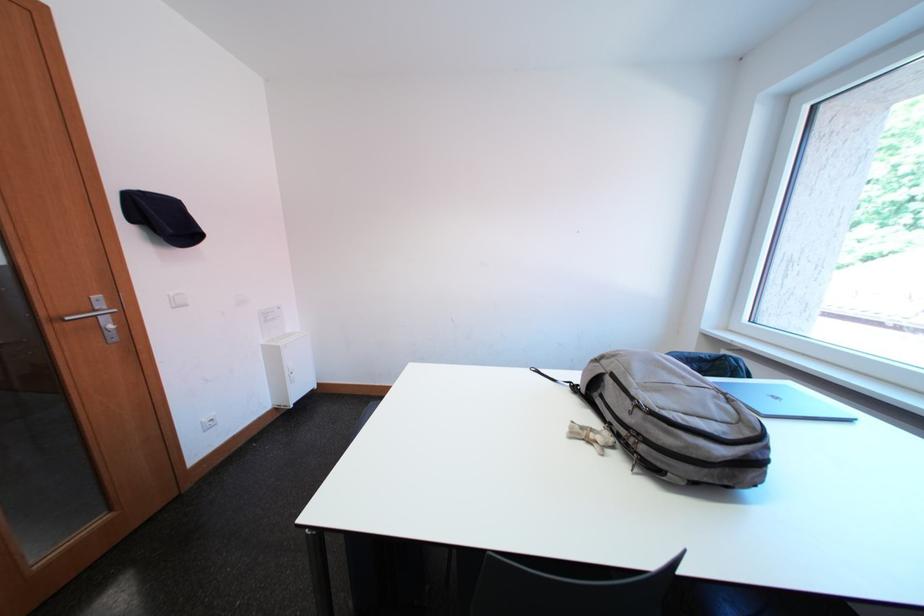
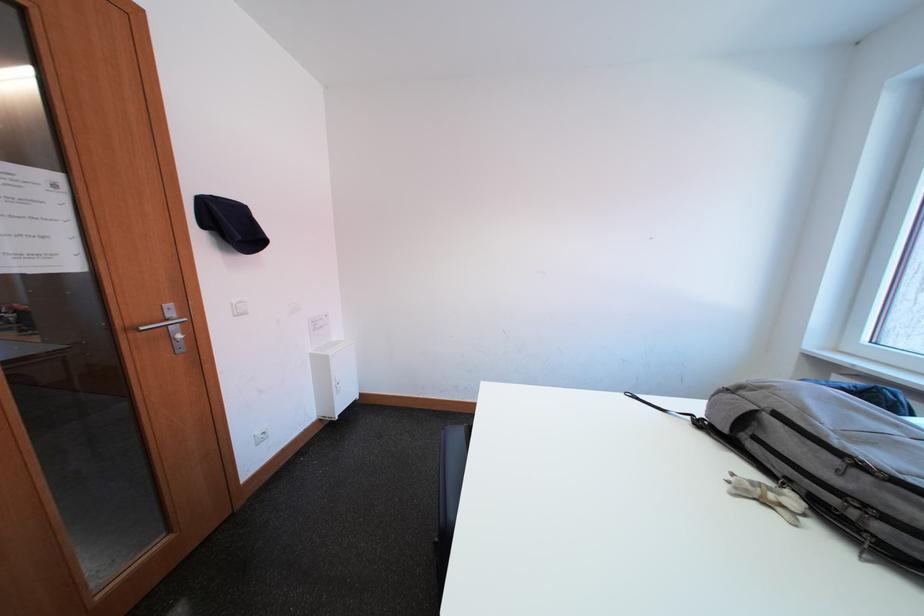
The images are taken continuously from a first-person perspective. In which direction are you moving?

The movement direction of the cameraman is left, forward.